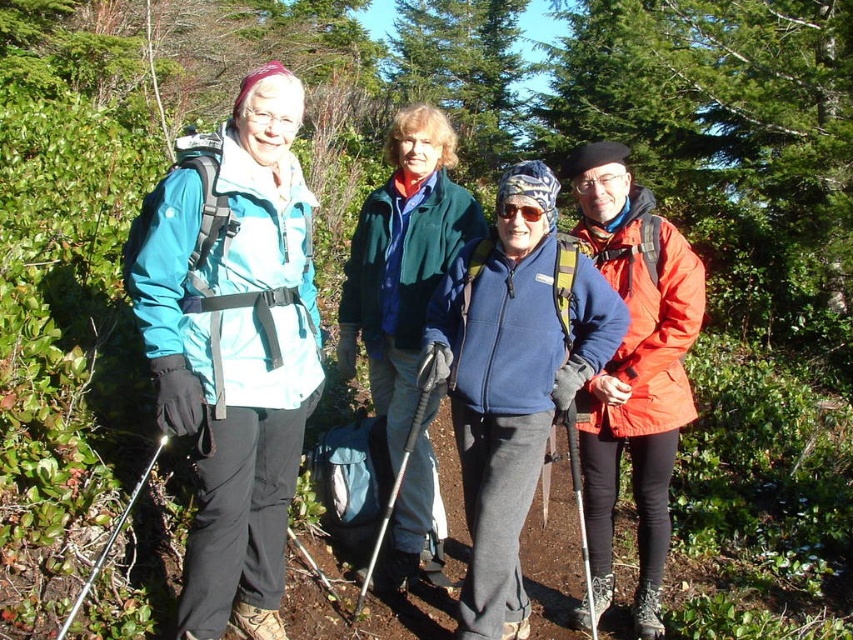
Between point (590, 396) and point (386, 288), which one is positioned in front?

Point (590, 396) is more forward.

Between point (660, 236) and point (352, 234), which one is positioned behind?

Positioned behind is point (352, 234).

The height and width of the screenshot is (640, 853). Identify the location of matte orange jacket at right. (634, 369).

Is teal matte jacket at left smaller than matte orange jacket at right?

Indeed, teal matte jacket at left has a smaller size compared to matte orange jacket at right.

What do you see at coordinates (233, 344) in the screenshot? Image resolution: width=853 pixels, height=640 pixels. I see `teal matte jacket at left` at bounding box center [233, 344].

Does point (264, 106) lie behind point (587, 172)?

That is False.

The width and height of the screenshot is (853, 640). I want to click on teal matte jacket at left, so click(x=233, y=344).

Who is taller, teal matte jacket at left or green fleece jacket at center?

Standing taller between the two is teal matte jacket at left.

Is point (161, 378) farther from camera compared to point (393, 323)?

No, (161, 378) is closer to viewer.

Where is `teal matte jacket at left`? Image resolution: width=853 pixels, height=640 pixels. teal matte jacket at left is located at coordinates (233, 344).